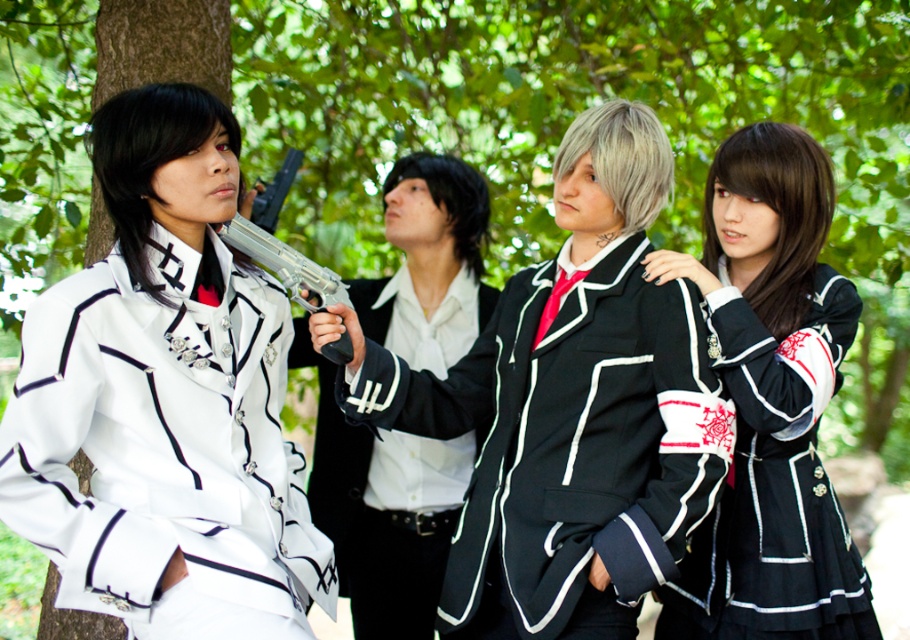
Looking at this image, you are a photographer positioned behind the group. You want to take a photo that clearly shows both the white glossy uniform at left and the white glossy shirt at center. Which object should you adjust to ensure both are visible?

The white glossy uniform at left is in front of the white glossy shirt at center. To ensure both are visible in the photo, you should move the white glossy uniform at left slightly backward so that the white glossy shirt at center becomes more visible behind it.